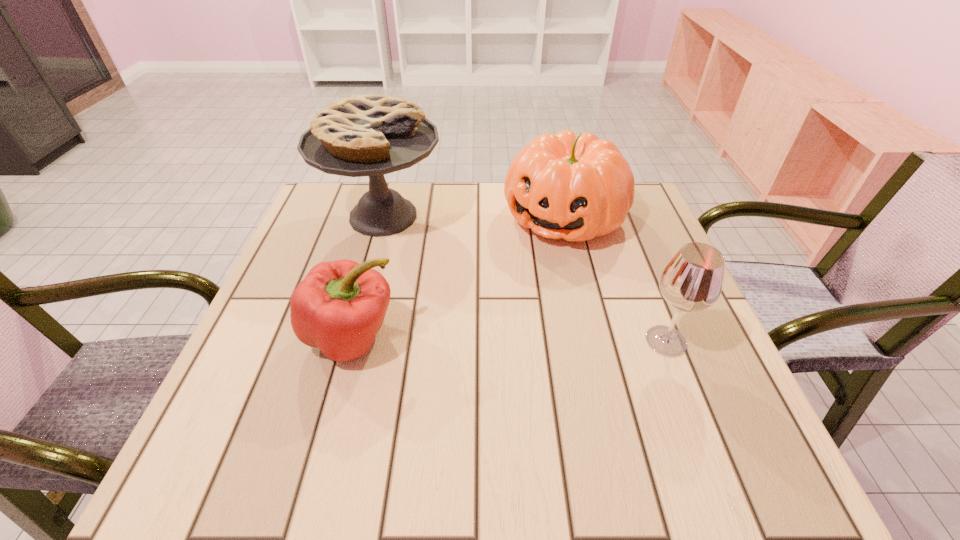
Find the location of `object that stands as the second closest to the wineglass`. object that stands as the second closest to the wineglass is located at coordinates (371, 135).

Locate an element on the screen. free point that satisfies the following two spatial constraints: 1. on the front side of the bell pepper; 2. on the right side of the tallest object is located at coordinates (350, 337).

Locate an element on the screen. Image resolution: width=960 pixels, height=540 pixels. vacant space that satisfies the following two spatial constraints: 1. on the front side of the bell pepper; 2. on the right side of the wineglass is located at coordinates (351, 341).